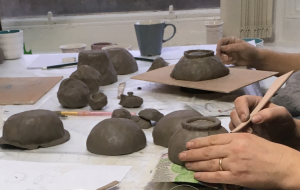
I want to click on clay bowls, so click(207, 123), click(204, 53).